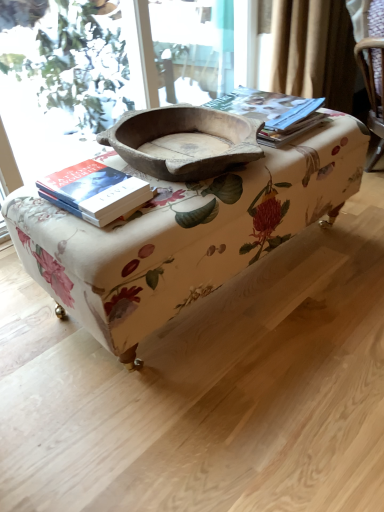
Image resolution: width=384 pixels, height=512 pixels. I want to click on vacant area that is in front of floral fabric ottoman at center, so click(x=226, y=397).